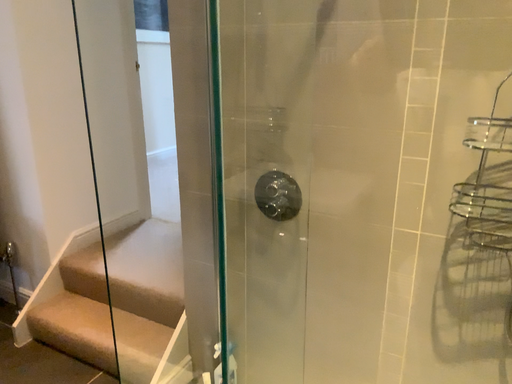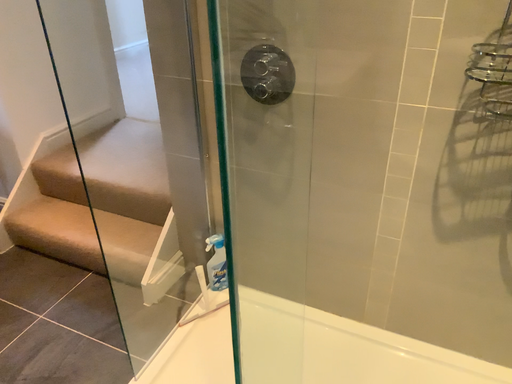
Question: Which way did the camera rotate in the video?

Choices:
 (A) rotated downward
 (B) rotated upward

Answer: (A)